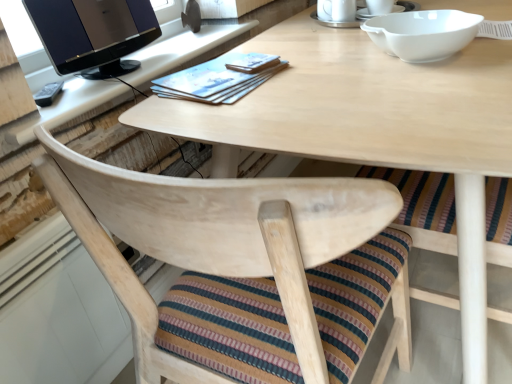
Describe the element at coordinates (341, 22) in the screenshot. I see `white ceramic saucer at upper center, the 1th saucer viewed from the left` at that location.

This screenshot has width=512, height=384. Find the location of `white ceramic saucer at upper center, the 1th saucer viewed from the left`. white ceramic saucer at upper center, the 1th saucer viewed from the left is located at coordinates (341, 22).

Considering the sizes of objects natural wood chair at center and white ceramic mug at upper center in the image provided, who is bigger, natural wood chair at center or white ceramic mug at upper center?

natural wood chair at center.

Are natural wood chair at center and white ceramic mug at upper center making contact?

natural wood chair at center and white ceramic mug at upper center are clearly separated.

Which is more to the right, natural wood chair at center or white ceramic mug at upper center?

white ceramic mug at upper center.

Considering the points (253, 346) and (348, 15), which point is in front, point (253, 346) or point (348, 15)?

The point (253, 346) is more forward.

Is the depth of white ceramic saucer at upper center, the 1th saucer viewed from the left, greater than that of white ceramic mug at upper center?

That is False.

Is white ceramic saucer at upper center, the 1th saucer viewed from the left, outside of white ceramic mug at upper center?

Absolutely, white ceramic saucer at upper center, the 1th saucer viewed from the left, is external to white ceramic mug at upper center.

What's the angular difference between natural wood chair at center and satin black monitor at upper left's facing directions?

There is a 85.7-degree angle between the facing directions of natural wood chair at center and satin black monitor at upper left.

Can you confirm if natural wood chair at center is positioned to the right of satin black monitor at upper left?

Yes, natural wood chair at center is to the right of satin black monitor at upper left.

Can you confirm if natural wood chair at center is smaller than satin black monitor at upper left?

No, natural wood chair at center is not smaller than satin black monitor at upper left.

Identify the location of computer monitor lying on the left of natural wood chair at center. (92, 32).

Is satin black monitor at upper left in front of or behind natural wood chair at center in the image?

Clearly, satin black monitor at upper left is behind natural wood chair at center.

Consider the image. Is satin black monitor at upper left not near natural wood chair at center?

satin black monitor at upper left is actually quite close to natural wood chair at center.

From the image's perspective, is satin black monitor at upper left positioned above or below natural wood chair at center?

Based on their image positions, satin black monitor at upper left is located above natural wood chair at center.

Who is shorter, satin black monitor at upper left or white ceramic saucer at upper center, which is the 2th saucer from right to left?

With less height is white ceramic saucer at upper center, which is the 2th saucer from right to left.

Is satin black monitor at upper left not close to white ceramic saucer at upper center, the 1th saucer viewed from the left?

That's not correct — satin black monitor at upper left is a little close to white ceramic saucer at upper center, the 1th saucer viewed from the left.

Is satin black monitor at upper left not inside white ceramic saucer at upper center, the 1th saucer viewed from the left?

Absolutely, satin black monitor at upper left is external to white ceramic saucer at upper center, the 1th saucer viewed from the left.

From a real-world perspective, is satin black monitor at upper left above or below white ceramic saucer at upper center, which is the 2th saucer from right to left?

satin black monitor at upper left is situated higher than white ceramic saucer at upper center, which is the 2th saucer from right to left, in the real world.

From a real-world perspective, which object stands above the other?

In real-world perspective, white glossy bowl at upper right is above.

Is point (362, 19) behind point (461, 11)?

Yes, point (362, 19) is behind point (461, 11).

Can white glossy bowl at upper right be found inside white ceramic saucer at upper center, the 1th saucer viewed from the left?

No, white glossy bowl at upper right is not inside white ceramic saucer at upper center, the 1th saucer viewed from the left.

Is white ceramic saucer at upper center, the 1th saucer viewed from the left, touching white glossy bowl at upper right?

No, white ceramic saucer at upper center, the 1th saucer viewed from the left, is not next to white glossy bowl at upper right.

Between point (323, 20) and point (42, 38), which one is positioned behind?

The point (323, 20) is behind.

Is white ceramic saucer at upper center, the 1th saucer viewed from the left, inside the boundaries of satin black monitor at upper left, or outside?

white ceramic saucer at upper center, the 1th saucer viewed from the left, is not enclosed by satin black monitor at upper left.

From the image's perspective, is white ceramic saucer at upper center, the 1th saucer viewed from the left, below satin black monitor at upper left?

No.

Between white ceramic saucer at upper center, the 1th saucer viewed from the left, and satin black monitor at upper left, which one has larger size?

Bigger between the two is satin black monitor at upper left.

Where is `chair below the white ceramic mug at upper center (from a real-world perspective)`? The image size is (512, 384). chair below the white ceramic mug at upper center (from a real-world perspective) is located at coordinates (242, 267).

You are a GUI agent. You are given a task and a screenshot of the screen. Output one action in this format:
    pyautogui.click(x=<x>, y=<y>)
    Task: Click on the tableware lying behind the white ceramic saucer at upper center, the 1th saucer viewed from the left
    
    Given the screenshot: What is the action you would take?
    pyautogui.click(x=336, y=10)

In the scene shown: Looking at the image, which one is located closer to natural wood chair at center, white glossy bowl at upper right or white ceramic saucer at upper center, positioned as the first saucer in right-to-left order?

Based on the image, white glossy bowl at upper right appears to be nearer to natural wood chair at center.

Looking at the image, which one is located further to white ceramic mug at upper center, white ceramic saucer at upper center, the 1th saucer viewed from the left, or white ceramic saucer at upper center, placed as the 2th saucer when sorted from left to right?

Based on the image, white ceramic saucer at upper center, placed as the 2th saucer when sorted from left to right, appears to be further to white ceramic mug at upper center.

Based on their spatial positions, is white ceramic saucer at upper center, positioned as the first saucer in right-to-left order, or white glossy bowl at upper right further from natural wood chair at center?

Among the two, white ceramic saucer at upper center, positioned as the first saucer in right-to-left order, is located further to natural wood chair at center.

Considering their positions, is satin black monitor at upper left positioned further to white ceramic saucer at upper center, placed as the 2th saucer when sorted from left to right, than white glossy bowl at upper right?

satin black monitor at upper left is further to white ceramic saucer at upper center, placed as the 2th saucer when sorted from left to right.

From the image, which object appears to be nearer to white glossy bowl at upper right, natural wood chair at center or white ceramic saucer at upper center, the 1th saucer viewed from the left?

white ceramic saucer at upper center, the 1th saucer viewed from the left, lies closer to white glossy bowl at upper right than the other object.

Which object lies further to the anchor point white ceramic mug at upper center, satin black monitor at upper left or natural wood chair at center?

natural wood chair at center.

When comparing their distances from white ceramic saucer at upper center, which is the 2th saucer from right to left, does white ceramic saucer at upper center, placed as the 2th saucer when sorted from left to right, or natural wood chair at center seem further?

natural wood chair at center lies further to white ceramic saucer at upper center, which is the 2th saucer from right to left, than the other object.

Which object lies further to the anchor point satin black monitor at upper left, white ceramic mug at upper center or white ceramic saucer at upper center, positioned as the first saucer in right-to-left order?

white ceramic saucer at upper center, positioned as the first saucer in right-to-left order, is further to satin black monitor at upper left.

At what (x,y) coordinates should I click in order to perform the action: click on tableware situated between satin black monitor at upper left and white ceramic saucer at upper center, placed as the 2th saucer when sorted from left to right, from left to right. Please return your answer as a coordinate pair (x, y). Image resolution: width=512 pixels, height=384 pixels. Looking at the image, I should click on (336, 10).

You are a GUI agent. You are given a task and a screenshot of the screen. Output one action in this format:
    pyautogui.click(x=<x>, y=<y>)
    Task: Click on the tableware between satin black monitor at upper left and white ceramic saucer at upper center, which is the 2th saucer from right to left, from left to right
    The image size is (512, 384).
    Given the screenshot: What is the action you would take?
    pos(336,10)

This screenshot has height=384, width=512. I want to click on bowl between natural wood chair at center and white ceramic saucer at upper center, positioned as the first saucer in right-to-left order, along the z-axis, so click(x=423, y=33).

The width and height of the screenshot is (512, 384). Find the location of `computer monitor between natural wood chair at center and white ceramic saucer at upper center, positioned as the first saucer in right-to-left order, along the z-axis`. computer monitor between natural wood chair at center and white ceramic saucer at upper center, positioned as the first saucer in right-to-left order, along the z-axis is located at coordinates (92, 32).